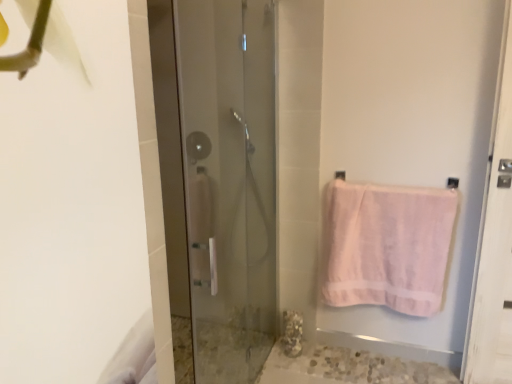
Question: Considering the relative sizes of transparent glass shower door at center and pink cotton towel at right in the image provided, is transparent glass shower door at center thinner than pink cotton towel at right?

Choices:
 (A) no
 (B) yes

Answer: (A)

Question: Can you confirm if transparent glass shower door at center is wider than pink cotton towel at right?

Choices:
 (A) yes
 (B) no

Answer: (A)

Question: Is transparent glass shower door at center next to pink cotton towel at right and touching it?

Choices:
 (A) no
 (B) yes

Answer: (A)

Question: Does transparent glass shower door at center turn towards pink cotton towel at right?

Choices:
 (A) yes
 (B) no

Answer: (A)

Question: Is transparent glass shower door at center at the left side of pink cotton towel at right?

Choices:
 (A) yes
 (B) no

Answer: (A)

Question: From a real-world perspective, is transparent glass shower door at center physically above pink cotton towel at right?

Choices:
 (A) no
 (B) yes

Answer: (B)

Question: Considering the relative positions of transparent glass shower door at center and clear glass shower at center in the image provided, is transparent glass shower door at center behind clear glass shower at center?

Choices:
 (A) no
 (B) yes

Answer: (A)

Question: Is transparent glass shower door at center oriented away from clear glass shower at center?

Choices:
 (A) yes
 (B) no

Answer: (A)

Question: Is clear glass shower at center completely or partially inside transparent glass shower door at center?

Choices:
 (A) no
 (B) yes

Answer: (A)

Question: Can you confirm if transparent glass shower door at center is positioned to the right of clear glass shower at center?

Choices:
 (A) no
 (B) yes

Answer: (B)

Question: Is transparent glass shower door at center positioned far away from clear glass shower at center?

Choices:
 (A) no
 (B) yes

Answer: (A)

Question: From a real-world perspective, does transparent glass shower door at center sit lower than clear glass shower at center?

Choices:
 (A) yes
 (B) no

Answer: (A)

Question: Would you say clear glass shower at center is outside transparent glass shower door at center?

Choices:
 (A) no
 (B) yes

Answer: (B)